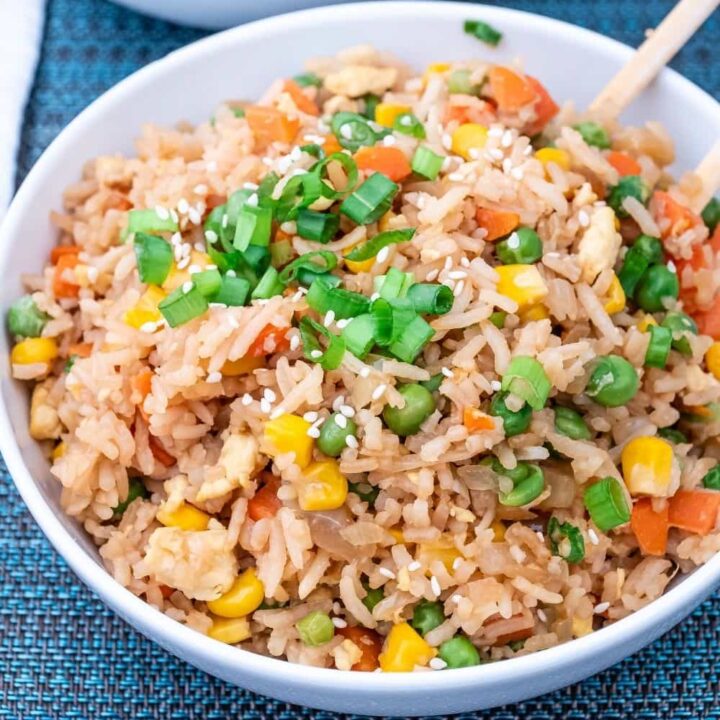
This screenshot has width=720, height=720. In order to click on inside white bowl in this screenshot , I will do `click(189, 96)`.